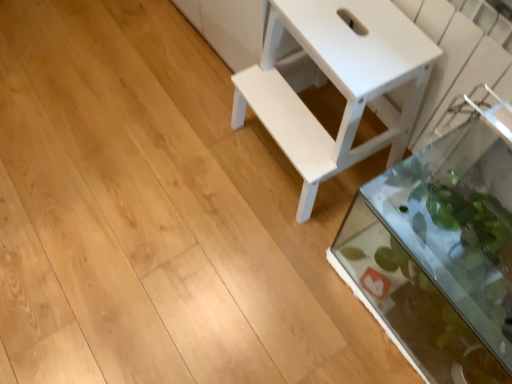
Locate an element on the screen. The width and height of the screenshot is (512, 384). vacant space positioned to the left of transparent glass tank at lower right is located at coordinates (292, 295).